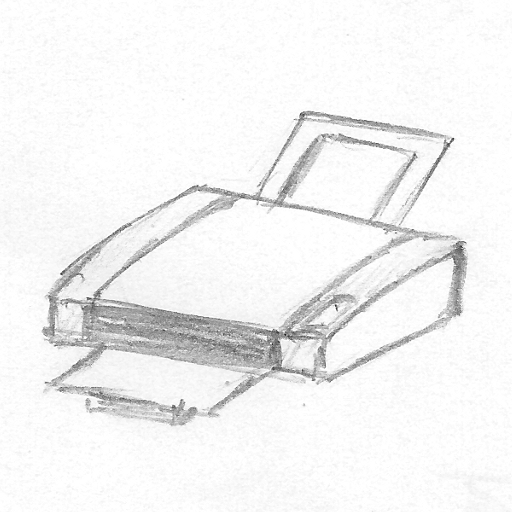
You are a GUI agent. You are given a task and a screenshot of the screen. Output one action in this format:
    pyautogui.click(x=<x>, y=<y>)
    Task: Click on the laser printer
    This screenshot has width=512, height=512.
    Given the screenshot: What is the action you would take?
    pyautogui.click(x=372, y=325)